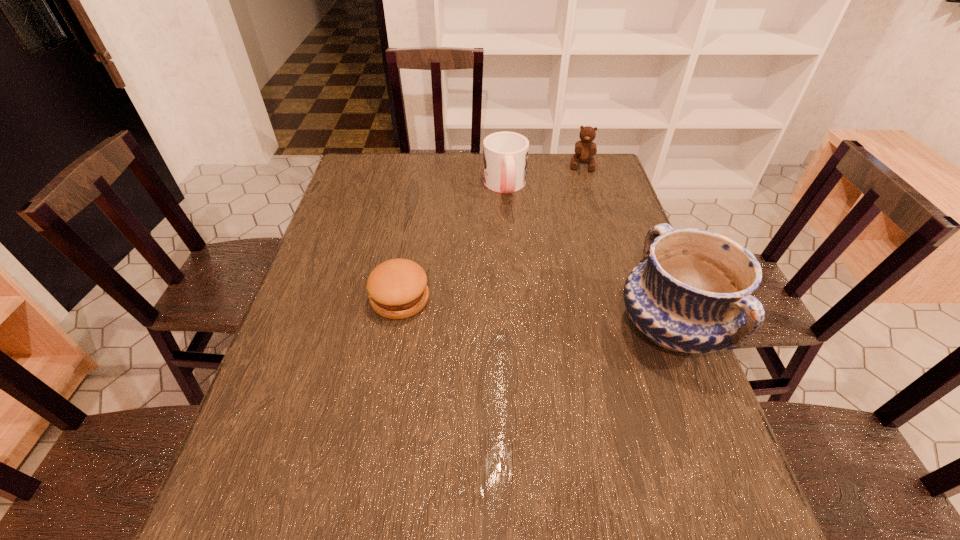
Locate an element on the screen. The width and height of the screenshot is (960, 540). free space located 0.160m on the face of the teddy bear is located at coordinates (578, 199).

Where is `free spot located on the face of the teddy bear`? The height and width of the screenshot is (540, 960). free spot located on the face of the teddy bear is located at coordinates (574, 229).

In order to click on vacant space located on the face of the teddy bear in this screenshot , I will do `click(579, 194)`.

This screenshot has width=960, height=540. Identify the location of mug that is at the far edge. (505, 154).

You are a GUI agent. You are given a task and a screenshot of the screen. Output one action in this format:
    pyautogui.click(x=<x>, y=<y>)
    Task: Click on the teddy bear that is positioned at the far edge
    This screenshot has width=960, height=540.
    Given the screenshot: What is the action you would take?
    pyautogui.click(x=585, y=149)

I want to click on pottery that is at the right edge, so click(x=691, y=292).

This screenshot has height=540, width=960. Identify the location of teddy bear that is at the right edge. (585, 149).

The image size is (960, 540). I want to click on object positioned at the far right corner, so pyautogui.click(x=585, y=149).

In the image, there is a desktop. Where is `vacant space at the far edge`? This screenshot has width=960, height=540. vacant space at the far edge is located at coordinates (449, 173).

Where is `free space at the near edge of the desktop`? free space at the near edge of the desktop is located at coordinates (476, 458).